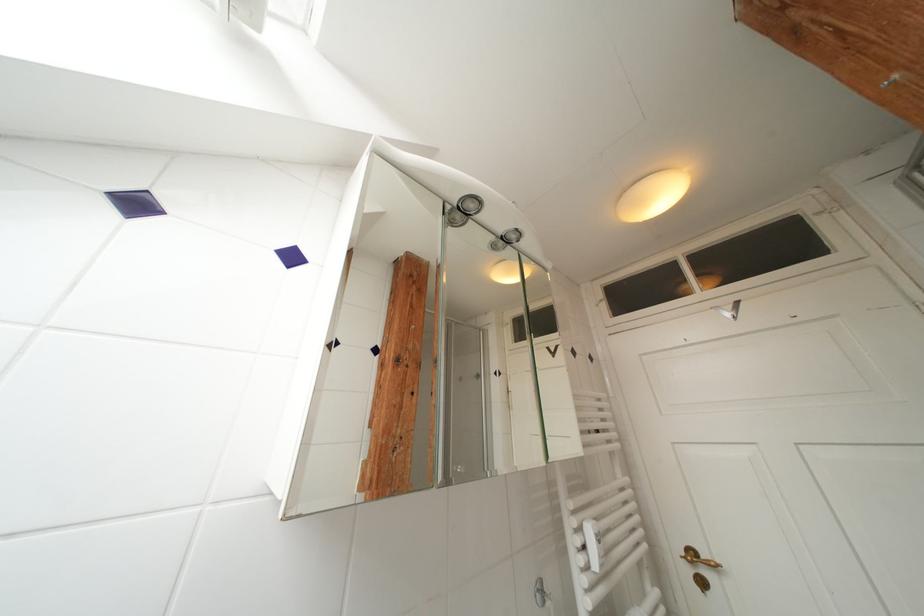
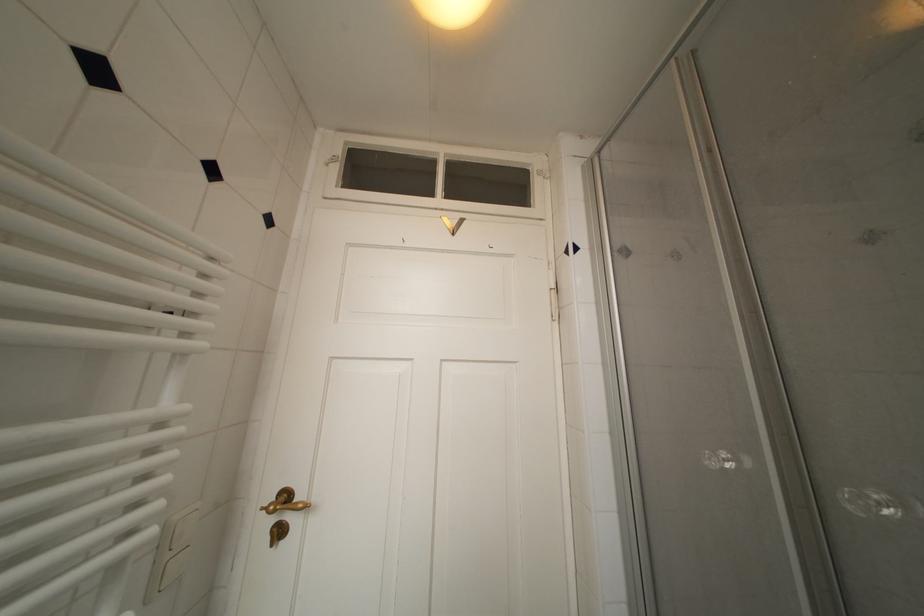
In the second image, find the point that corresponds to pixel 699 557 in the first image.

(293, 500)